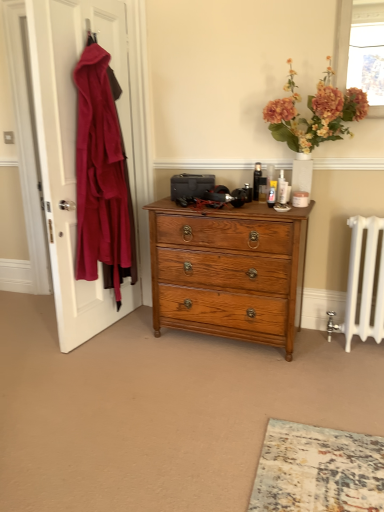
Question: Considering the positions of matte orange flowers at upper right and translucent glass window screen at upper right in the image, is matte orange flowers at upper right taller or shorter than translucent glass window screen at upper right?

Choices:
 (A) tall
 (B) short

Answer: (A)

Question: Is matte orange flowers at upper right bigger or smaller than translucent glass window screen at upper right?

Choices:
 (A) big
 (B) small

Answer: (A)

Question: Which object is the closest to the shiny oak chest of drawers at center?

Choices:
 (A) matte orange flowers at upper right
 (B) translucent glass window screen at upper right
 (C) velvet red coat at left

Answer: (A)

Question: Which of these objects is positioned closest to the translucent glass window screen at upper right?

Choices:
 (A) velvet red coat at left
 (B) matte orange flowers at upper right
 (C) shiny oak chest of drawers at center

Answer: (B)